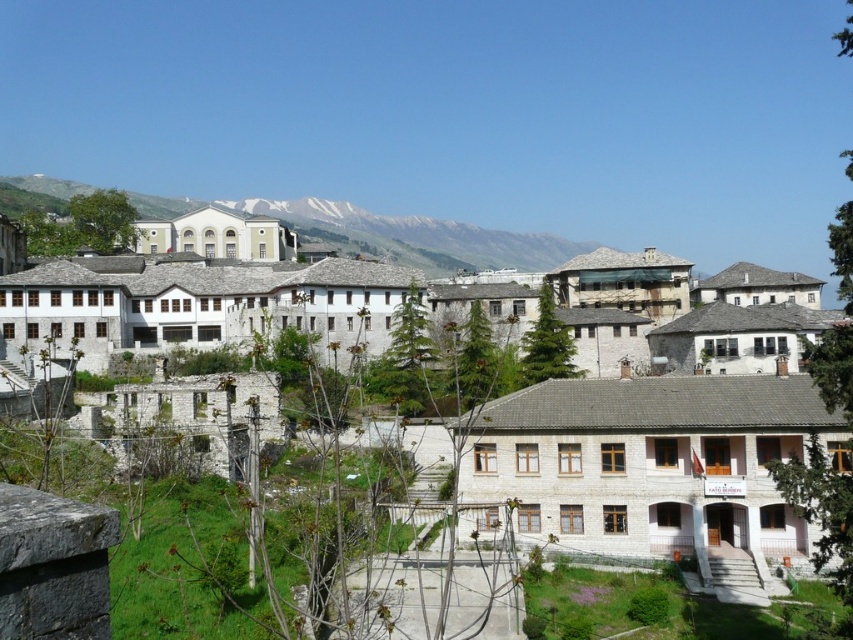
Question: Is white stone building at center to the right of white snow-covered mountain at upper center from the viewer's perspective?

Choices:
 (A) yes
 (B) no

Answer: (A)

Question: Considering the relative positions of white stone building at center and white snow-covered mountain at upper center in the image provided, where is white stone building at center located with respect to white snow-covered mountain at upper center?

Choices:
 (A) right
 (B) left

Answer: (A)

Question: Which object appears closest to the camera in this image?

Choices:
 (A) white snow-covered mountain at upper center
 (B) white stone building at center

Answer: (B)

Question: Can you confirm if white stone building at center is positioned to the right of white snow-covered mountain at upper center?

Choices:
 (A) yes
 (B) no

Answer: (A)

Question: Which point is farther to the camera?

Choices:
 (A) (670, 554)
 (B) (535, 252)

Answer: (B)